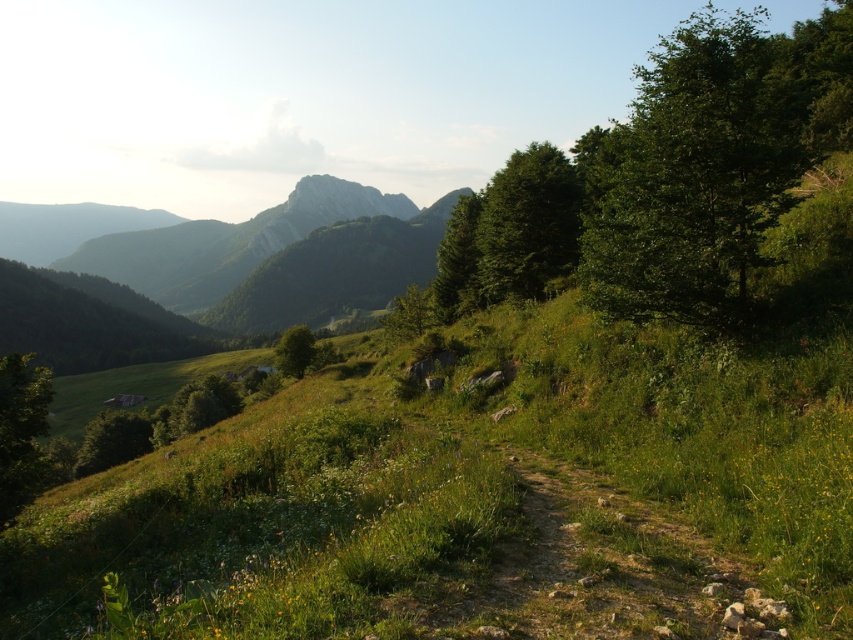
Consider the image. Is green grassy at lower left bigger than dirt/gravel path at center?

Correct, green grassy at lower left is larger in size than dirt/gravel path at center.

Can you confirm if green grassy at lower left is positioned above dirt/gravel path at center?

No, green grassy at lower left is not above dirt/gravel path at center.

This screenshot has height=640, width=853. What do you see at coordinates (468, 497) in the screenshot? I see `green grassy at lower left` at bounding box center [468, 497].

At what (x,y) coordinates should I click in order to perform the action: click on green grassy at lower left. Please return your answer as a coordinate pair (x, y). The width and height of the screenshot is (853, 640). Looking at the image, I should click on (468, 497).

Where is `rugged granite mountain at upper center`? This screenshot has height=640, width=853. rugged granite mountain at upper center is located at coordinates (277, 257).

Is rugged granite mountain at upper center to the right of green leafy tree at lower left from the viewer's perspective?

No, rugged granite mountain at upper center is not to the right of green leafy tree at lower left.

Who is more distant from viewer, [202,227] or [45,371]?

Positioned behind is point [202,227].

You are a GUI agent. You are given a task and a screenshot of the screen. Output one action in this format:
    pyautogui.click(x=<x>, y=<y>)
    Task: Click on the rugged granite mountain at upper center
    Image resolution: width=853 pixels, height=640 pixels.
    Given the screenshot: What is the action you would take?
    pyautogui.click(x=277, y=257)

What do you see at coordinates (468, 497) in the screenshot? I see `green grassy at lower left` at bounding box center [468, 497].

Is point (711, 451) positioned behind point (21, 452)?

That is False.

Where is `green grassy at lower left`? The image size is (853, 640). green grassy at lower left is located at coordinates (468, 497).